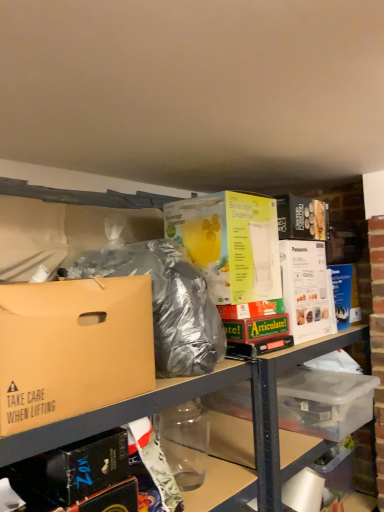
Question: Does clear plastic container at center have a greater width compared to yellow cardboard beverage dispenser at center, the 2th box from the front?

Choices:
 (A) no
 (B) yes

Answer: (B)

Question: Is clear plastic container at center in front of yellow cardboard beverage dispenser at center, the 2th box from the front?

Choices:
 (A) yes
 (B) no

Answer: (A)

Question: Is clear plastic container at center at the left side of yellow cardboard beverage dispenser at center, the 2th box positioned from the left?

Choices:
 (A) no
 (B) yes

Answer: (A)

Question: Is the position of clear plastic container at center more distant than that of yellow cardboard beverage dispenser at center, the 2th box positioned from the left?

Choices:
 (A) yes
 (B) no

Answer: (B)

Question: Can you confirm if clear plastic container at center is positioned to the right of yellow cardboard beverage dispenser at center, which is the first box from right to left?

Choices:
 (A) yes
 (B) no

Answer: (A)

Question: Does clear plastic container at center have a greater height compared to yellow cardboard beverage dispenser at center, the 2th box positioned from the left?

Choices:
 (A) no
 (B) yes

Answer: (B)

Question: Can you confirm if clear plastic bottle at lower center is shorter than brown cardboard box at left, which appears as the 1th box when viewed from the left?

Choices:
 (A) yes
 (B) no

Answer: (B)

Question: From a real-world perspective, is clear plastic bottle at lower center over brown cardboard box at left, which ranks as the second box in right-to-left order?

Choices:
 (A) yes
 (B) no

Answer: (B)

Question: Is clear plastic bottle at lower center bigger than brown cardboard box at left, which ranks as the second box in right-to-left order?

Choices:
 (A) no
 (B) yes

Answer: (A)

Question: Is clear plastic bottle at lower center turned away from brown cardboard box at left, which ranks as the second box in right-to-left order?

Choices:
 (A) yes
 (B) no

Answer: (B)

Question: Is clear plastic bottle at lower center at the left side of brown cardboard box at left, the first box from the front?

Choices:
 (A) no
 (B) yes

Answer: (A)

Question: Is clear plastic bottle at lower center to the right of brown cardboard box at left, which ranks as the second box in right-to-left order, from the viewer's perspective?

Choices:
 (A) no
 (B) yes

Answer: (B)

Question: Is clear plastic bottle at lower center facing away from clear plastic storage box at lower right?

Choices:
 (A) yes
 (B) no

Answer: (B)